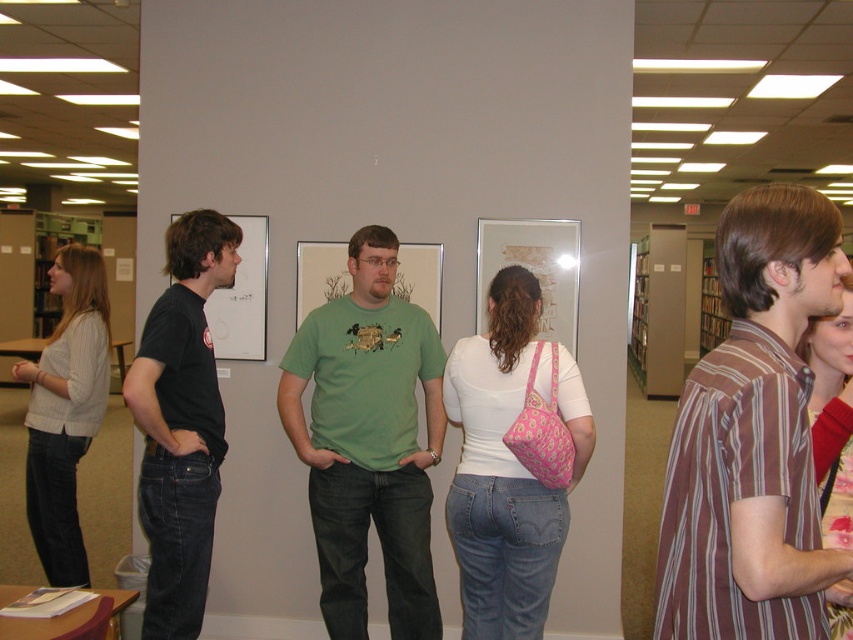
Question: Is brown striped shirt at right positioned at the back of light beige sweater at left?

Choices:
 (A) no
 (B) yes

Answer: (A)

Question: Is white matte shirt at center wider than black cotton t-shirt at left?

Choices:
 (A) yes
 (B) no

Answer: (A)

Question: Which object appears closest to the camera in this image?

Choices:
 (A) brown striped shirt at right
 (B) light beige sweater at left

Answer: (A)

Question: Observing the image, what is the correct spatial positioning of white matte shirt at center in reference to floral fabric purse at center?

Choices:
 (A) right
 (B) left

Answer: (B)

Question: Among these points, which one is nearest to the camera?

Choices:
 (A) (477, 412)
 (B) (86, 420)

Answer: (A)

Question: Which point is farther to the camera?

Choices:
 (A) brown striped shirt at right
 (B) black cotton t-shirt at left
 (C) light beige sweater at left
 (D) green matte t-shirt at center

Answer: (C)